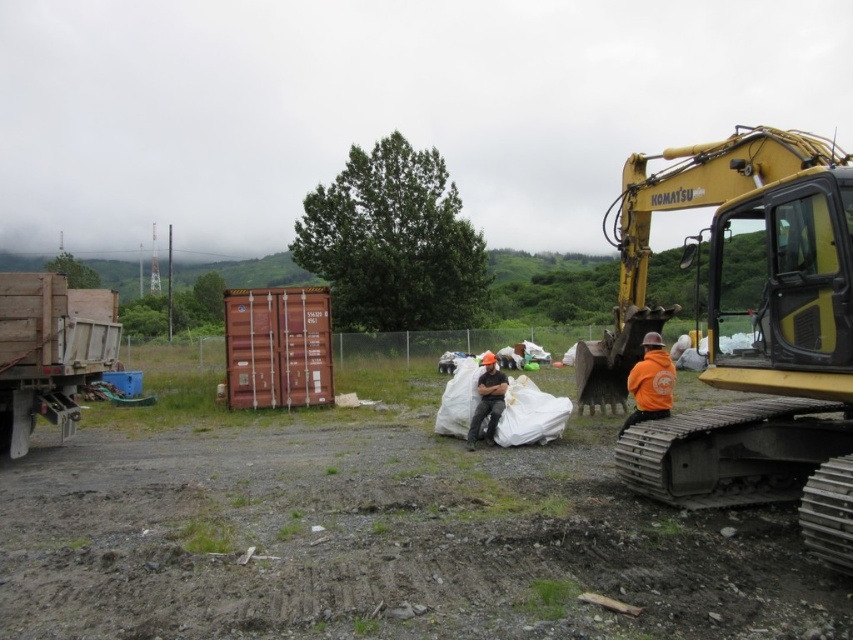
Does yellow metallic excavator at right have a lesser width compared to orange fleece jacket at lower right?

In fact, yellow metallic excavator at right might be wider than orange fleece jacket at lower right.

Between point (828, 483) and point (645, 401), which one is positioned behind?

The point (645, 401) is more distant.

At what (x,y) coordinates should I click in order to perform the action: click on yellow metallic excavator at right. Please return your answer as a coordinate pair (x, y). This screenshot has height=640, width=853. Looking at the image, I should click on (749, 330).

Locate an element on the screen. This screenshot has width=853, height=640. yellow metallic excavator at right is located at coordinates (749, 330).

Does yellow metallic excavator at right appear on the left side of wooden truck at left?

No, yellow metallic excavator at right is not to the left of wooden truck at left.

Between yellow metallic excavator at right and wooden truck at left, which one is positioned higher?

yellow metallic excavator at right is higher up.

The height and width of the screenshot is (640, 853). Describe the element at coordinates (749, 330) in the screenshot. I see `yellow metallic excavator at right` at that location.

This screenshot has width=853, height=640. What are the coordinates of `yellow metallic excavator at right` in the screenshot? It's located at (749, 330).

Does orange fleece jacket at lower right have a greater height compared to orange hard hat at center?

No.

Can you confirm if orange fleece jacket at lower right is positioned above orange hard hat at center?

Yes, orange fleece jacket at lower right is above orange hard hat at center.

Between point (666, 404) and point (491, 403), which one is positioned behind?

The point (491, 403) is behind.

Locate an element on the screen. orange fleece jacket at lower right is located at coordinates (650, 381).